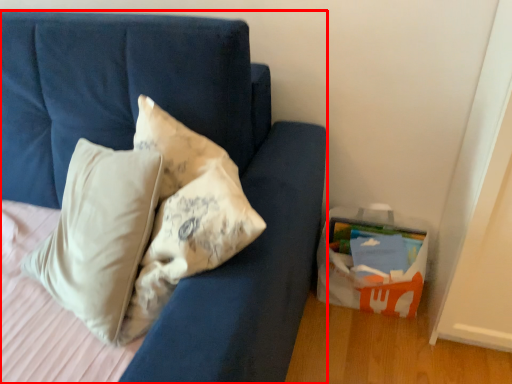
Question: Considering the relative positions of furniture (annotated by the red box) and cardboard box in the image provided, where is furniture (annotated by the red box) located with respect to the staircase?

Choices:
 (A) left
 (B) right

Answer: (A)